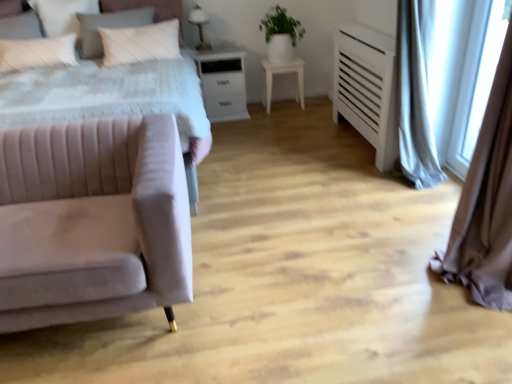
Locate an element on the screen. Image resolution: width=512 pixels, height=384 pixels. vacant area that lies between velvet pink couch at left and light gray fabric curtain at right is located at coordinates (316, 237).